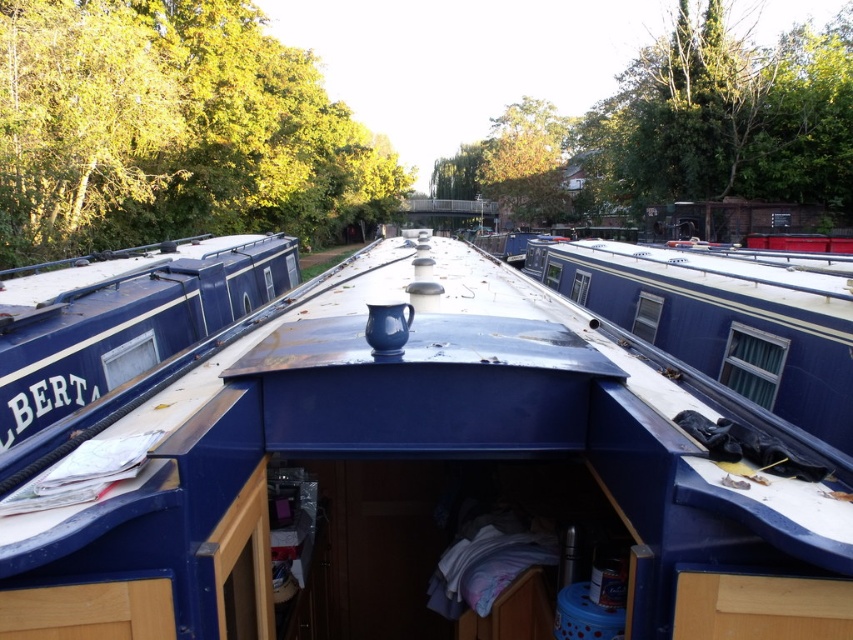
Question: In this image, where is blue painted cabin at right located relative to blue painted wood barge at left?

Choices:
 (A) below
 (B) above

Answer: (B)

Question: Which of the following is the closest to the observer?

Choices:
 (A) (30, 308)
 (B) (538, 340)

Answer: (B)

Question: Is glossy ceramic mug at upper center wider than blue painted cabin at right?

Choices:
 (A) yes
 (B) no

Answer: (A)

Question: Which of these objects is positioned farthest from the blue painted cabin at right?

Choices:
 (A) glossy ceramic mug at upper center
 (B) blue painted wood barge at left

Answer: (B)

Question: Can you confirm if blue painted cabin at right is positioned to the left of blue painted wood barge at left?

Choices:
 (A) yes
 (B) no

Answer: (B)

Question: Which point is closer to the camera taking this photo?

Choices:
 (A) (733, 460)
 (B) (585, 260)
 (C) (138, 259)

Answer: (A)